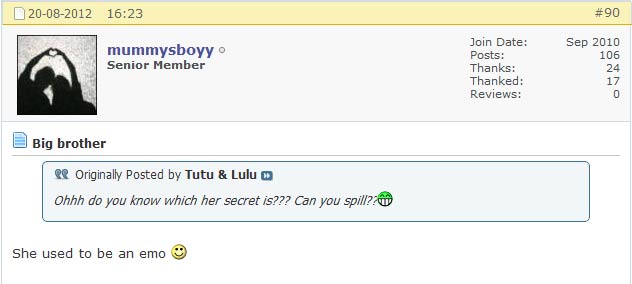
You are a GUI agent. You are given a task and a screenshot of the screen. Output one action in this format:
    pyautogui.click(x=<x>, y=<y>)
    Task: Click on the file notes
    
    Given the screenshot: What is the action you would take?
    pyautogui.click(x=18, y=139)